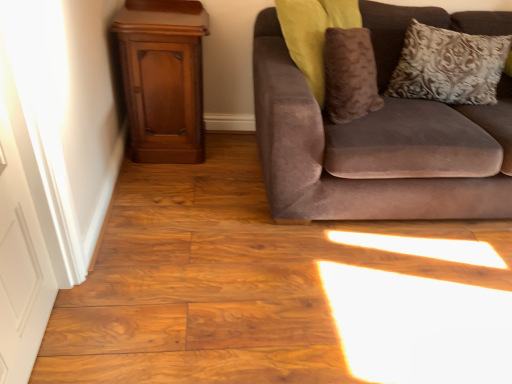
Identify the location of vacant space behind white painted wood door at left. The width and height of the screenshot is (512, 384). (106, 283).